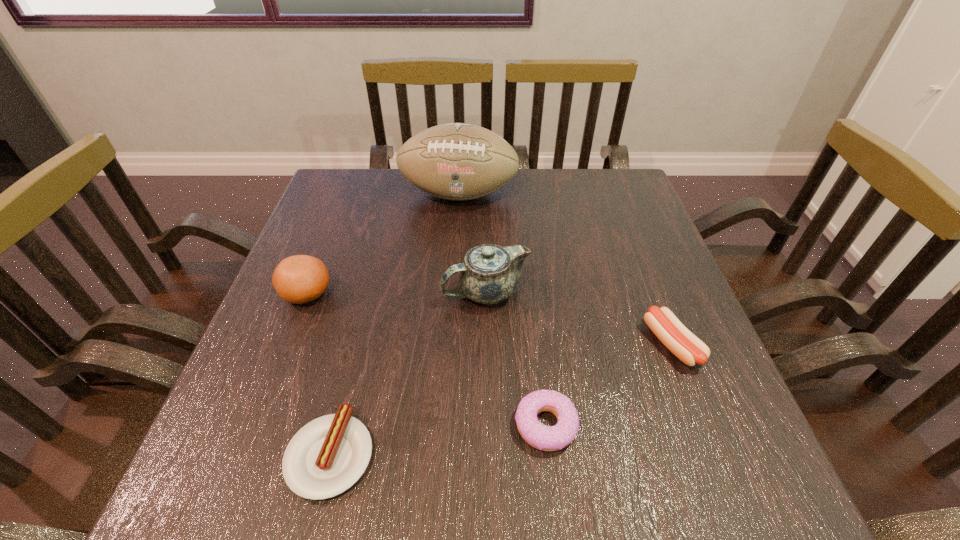
Find the location of a particular element. free space at the far right corner of the desktop is located at coordinates point(589,177).

Find the location of a particular element. This screenshot has height=540, width=960. free space between the leftmost object and the left sausage is located at coordinates (319, 374).

You are a GUI agent. You are given a task and a screenshot of the screen. Output one action in this format:
    pyautogui.click(x=<x>, y=<y>)
    Task: Click on the empty space that is in between the fourth shortest object and the football (American)
    This screenshot has height=540, width=960.
    Given the screenshot: What is the action you would take?
    pyautogui.click(x=383, y=244)

What are the coordinates of `free point between the leftmost object and the farther sausage` in the screenshot? It's located at (490, 319).

Where is `unoccupied position between the third tallest object and the fourth farthest object`? unoccupied position between the third tallest object and the fourth farthest object is located at coordinates (490, 319).

The width and height of the screenshot is (960, 540). I want to click on free space between the fifth shortest object and the doughnut, so click(516, 359).

The width and height of the screenshot is (960, 540). Identify the location of vacant point located between the clementine and the rightmost object. (490, 319).

The height and width of the screenshot is (540, 960). In order to click on vacant space that's between the doughnut and the tallest object in this screenshot , I will do `click(503, 309)`.

The width and height of the screenshot is (960, 540). What are the coordinates of `free space between the doughnut and the second tallest object` in the screenshot? It's located at click(516, 359).

At what (x,y) coordinates should I click in order to perform the action: click on unoccupied position between the football (American) and the third tallest object. Please return your answer as a coordinate pair (x, y). Looking at the image, I should click on (383, 244).